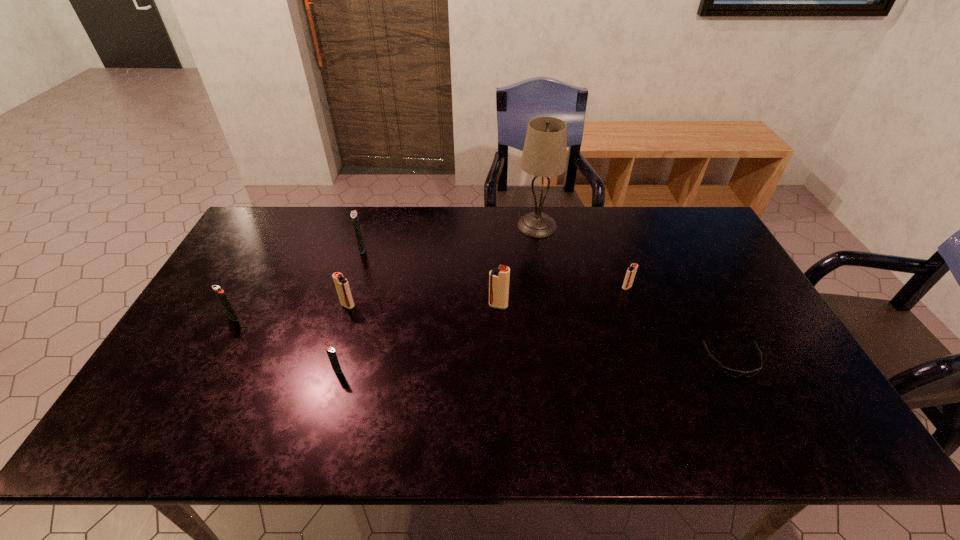
Locate an element on the screen. This screenshot has height=540, width=960. free space at the near edge of the desktop is located at coordinates (609, 447).

Locate an element on the screen. Image resolution: width=960 pixels, height=540 pixels. vacant space at the left edge of the desktop is located at coordinates (212, 290).

You are a GUI agent. You are given a task and a screenshot of the screen. Output one action in this format:
    pyautogui.click(x=<x>, y=<y>)
    Task: Click on the blank space at the right edge of the desktop
    This screenshot has height=540, width=960.
    Given the screenshot: What is the action you would take?
    pyautogui.click(x=707, y=309)

Locate an element on the screen. The height and width of the screenshot is (540, 960). vacant space at the far left corner of the desktop is located at coordinates (260, 223).

I want to click on vacant region at the near left corner of the desktop, so click(160, 447).

Locate an element on the screen. This screenshot has height=540, width=960. vacant space at the near right corner of the desktop is located at coordinates click(x=831, y=447).

Find the location of a particular element. This screenshot has height=540, width=960. free spot between the second biggest red igniter and the leftmost object is located at coordinates (291, 312).

You are a GUI agent. You are given a task and a screenshot of the screen. Output one action in this format:
    pyautogui.click(x=<x>, y=<y>)
    Task: Click on the vacant area between the smallest red igniter and the leftmost red igniter
    This screenshot has height=540, width=960.
    Given the screenshot: What is the action you would take?
    pyautogui.click(x=488, y=296)

Locate an element on the screen. free area in between the rightmost black igniter and the sunglasses is located at coordinates (536, 366).

The height and width of the screenshot is (540, 960). I want to click on unoccupied area between the biggest red igniter and the second nearest black igniter, so coord(366,312).